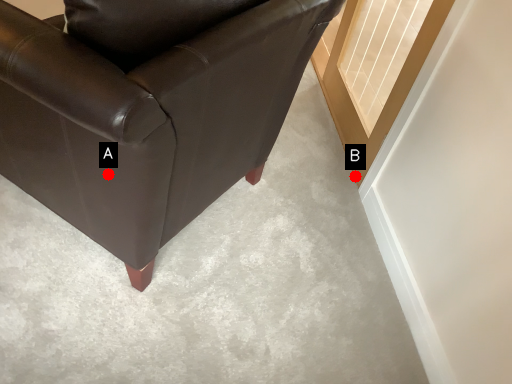
Question: Two points are circled on the image, labeled by A and B beside each circle. Among these points, which one is nearest to the camera?

Choices:
 (A) A is closer
 (B) B is closer

Answer: (A)